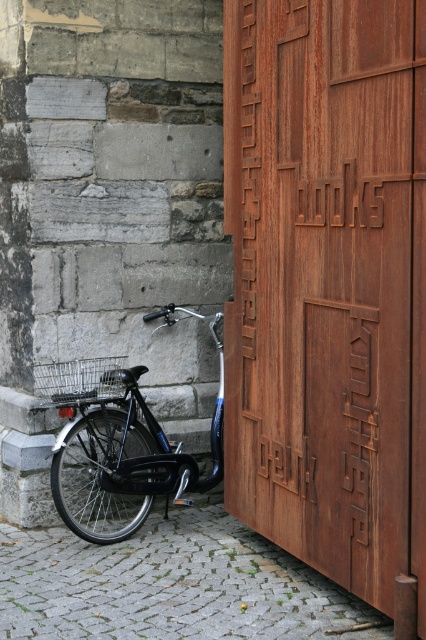
You are standing in front of the stone wall and notice the rusty metal door at center and the shiny black bicycle at lower left. Which object is closer to you?

The rusty metal door at center is positioned over the shiny black bicycle at lower left, meaning it is closer to you.

You are a delivery person trying to enter through the rusty metal door at center. However, the shiny black bicycle at lower left is blocking your path. Can you walk around the bicycle to reach the door?

The rusty metal door at center is in front of the shiny black bicycle at lower left, meaning the bicycle is behind the door from your perspective. Since the door is in front, you don not need to go around the bicycle to reach it. Simply approach the door directly.

You are standing in front of a stone wall with a wooden door to the right. You notice two points marked on the wall. One is at coordinate point (291,227) and the other at point (103,396). Which point is closer to you?

Point (291,227) is in front of point (103,396), so it is closer to you.